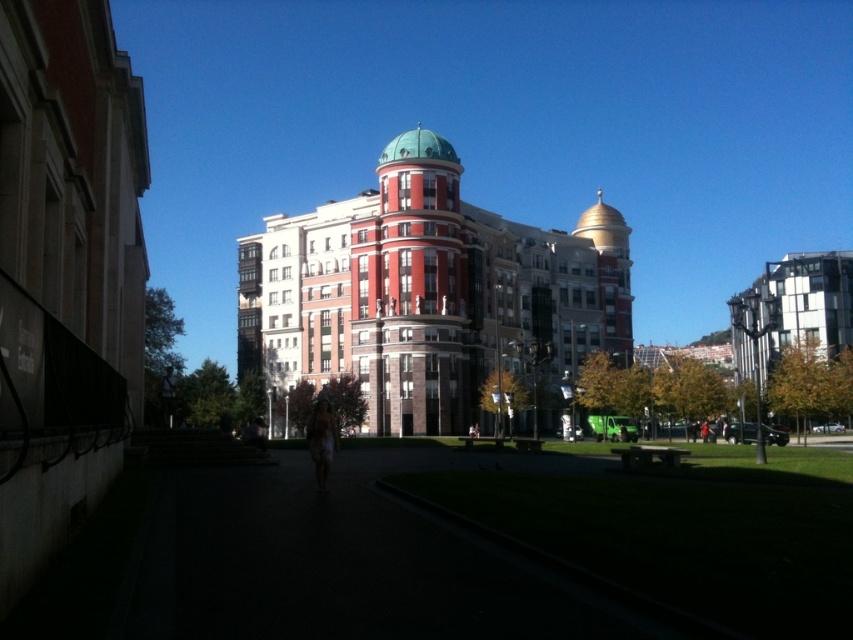
You are standing at the entrance of the building and want to locate the green dome at center. According to the coordinates provided, where should you look relative to the building?

The green dome at center is located at coordinates point (428, 298), which means it is positioned slightly to the right and center of the building.

You are standing on the paved pathway and looking at the building. Which dome, the green dome at center or the teal dome at center, is positioned higher up on the building?

The teal dome at center is positioned higher up on the building because the green dome at center is located below it.